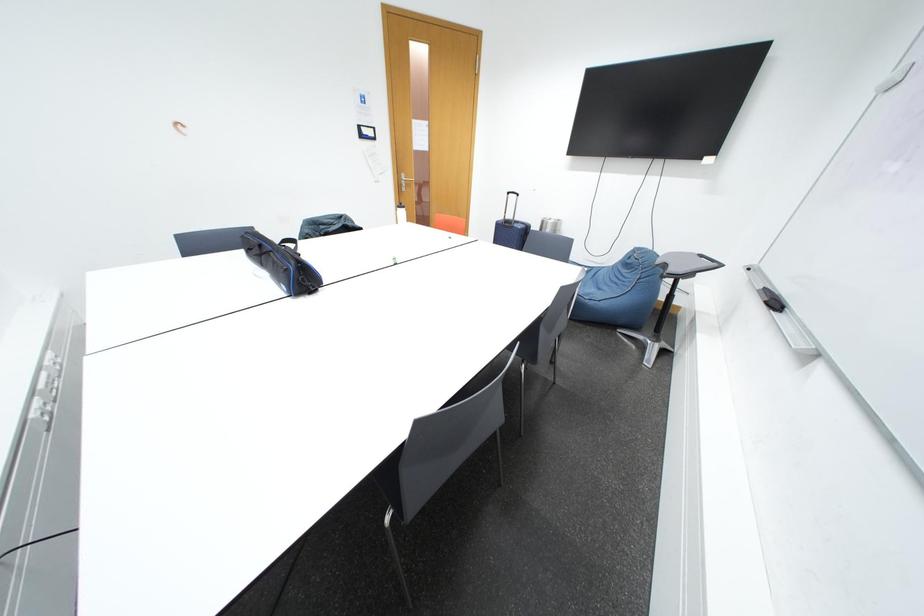
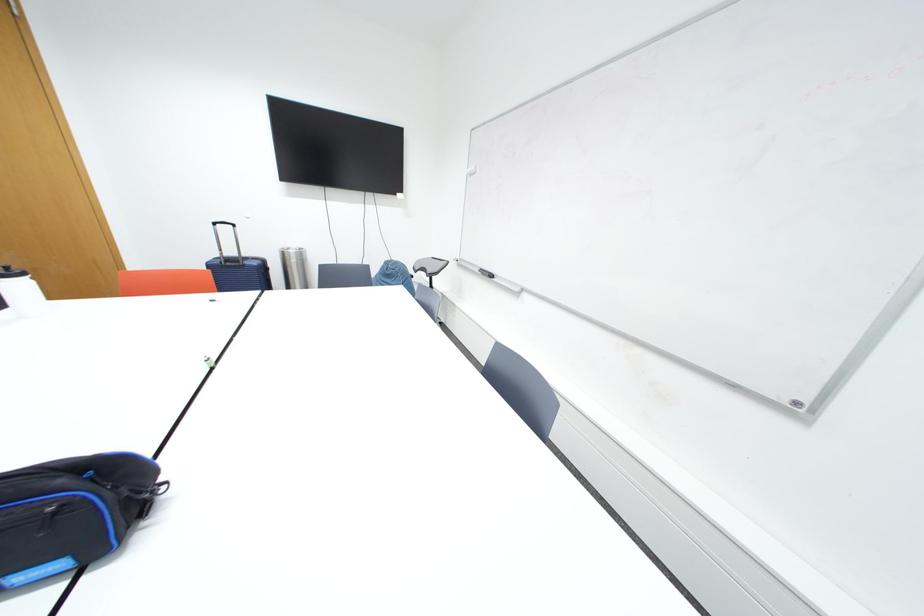
Question: The images are taken continuously from a first-person perspective. In which direction is your viewpoint rotating?

Choices:
 (A) Left
 (B) Right
 (C) Up
 (D) Down

Answer: (B)